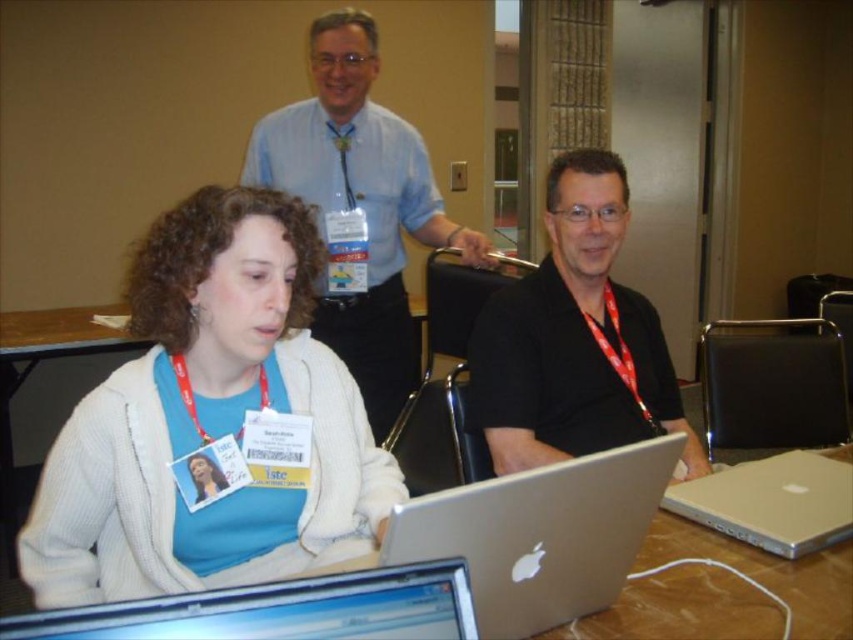
You are a participant in the conference and need to locate your assigned laptop. You remember that your laptop is the one positioned to the right of the other silver laptop. Which laptop should you choose between the silver metallic laptop at center and the silver metallic laptop at lower center?

The silver metallic laptop at center is to the right of the silver metallic laptop at lower center, so you should choose the silver metallic laptop at center.

You are a photographer trying to capture a closeup shot of the silver metallic laptop at lower right without including the black matte shirt at center in the frame. Based on their sizes, do you think this is possible?

The black matte shirt at center might be wider than silver metallic laptop at lower right, so it might block the view. It might not be possible to capture the silver metallic laptop at lower right without including the black matte shirt at center in the frame.